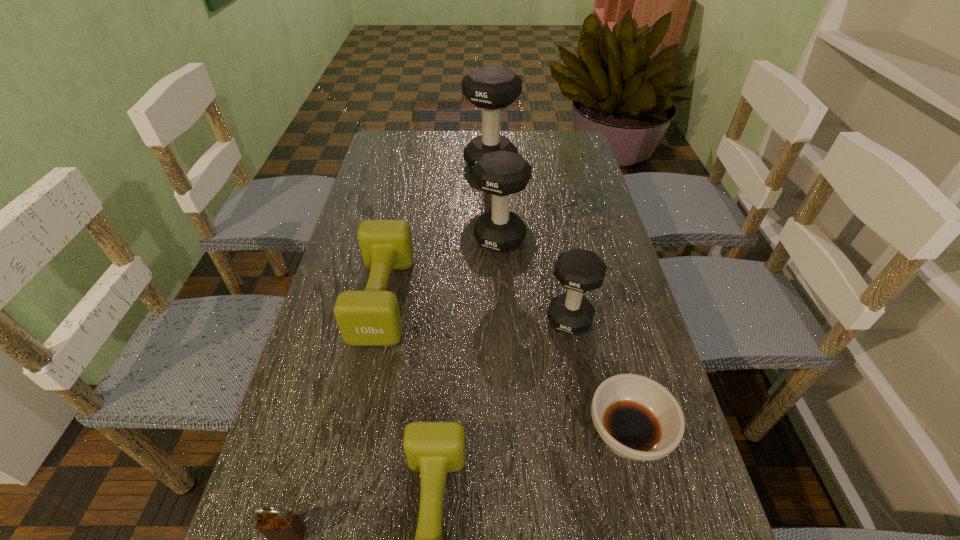
I want to click on free space located on the back of the second farthest dumbbell, so click(x=495, y=158).

This screenshot has height=540, width=960. What are the coordinates of `free space located 0.310m on the left of the smallest gray dumbbell` in the screenshot? It's located at (x=413, y=319).

You are a GUI agent. You are given a task and a screenshot of the screen. Output one action in this format:
    pyautogui.click(x=<x>, y=<y>)
    Task: Click on the free region located on the back of the bigger olive dumbbell
    This screenshot has width=960, height=540.
    Given the screenshot: What is the action you would take?
    pyautogui.click(x=407, y=183)

The height and width of the screenshot is (540, 960). In order to click on free space located on the back of the soup bowl in this screenshot , I will do `click(597, 318)`.

This screenshot has height=540, width=960. Identify the location of object at the far edge. (491, 88).

Image resolution: width=960 pixels, height=540 pixels. Identify the location of object at the left edge. (371, 317).

At what (x,y) coordinates should I click in order to perform the action: click on dumbbell located at the right edge. Please return your answer as a coordinate pair (x, y). The image size is (960, 540). Looking at the image, I should click on (578, 270).

Where is `soup bowl that is at the right edge`? soup bowl that is at the right edge is located at coordinates (637, 418).

At what (x,y) coordinates should I click in order to perform the action: click on vacant space at the far edge. Please return your answer as a coordinate pair (x, y). This screenshot has width=960, height=540. Looking at the image, I should click on (532, 157).

The height and width of the screenshot is (540, 960). Identify the location of free point at the left edge. (381, 170).